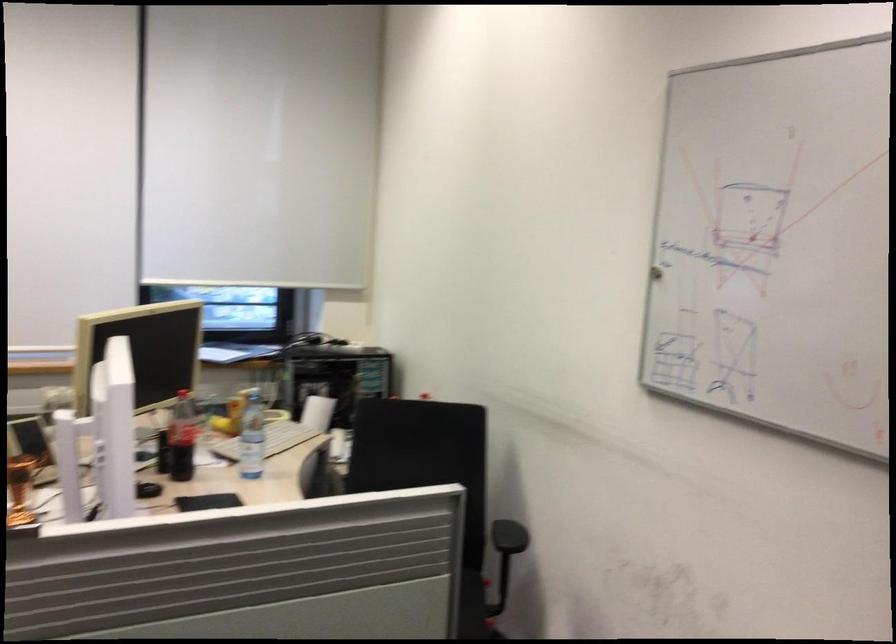
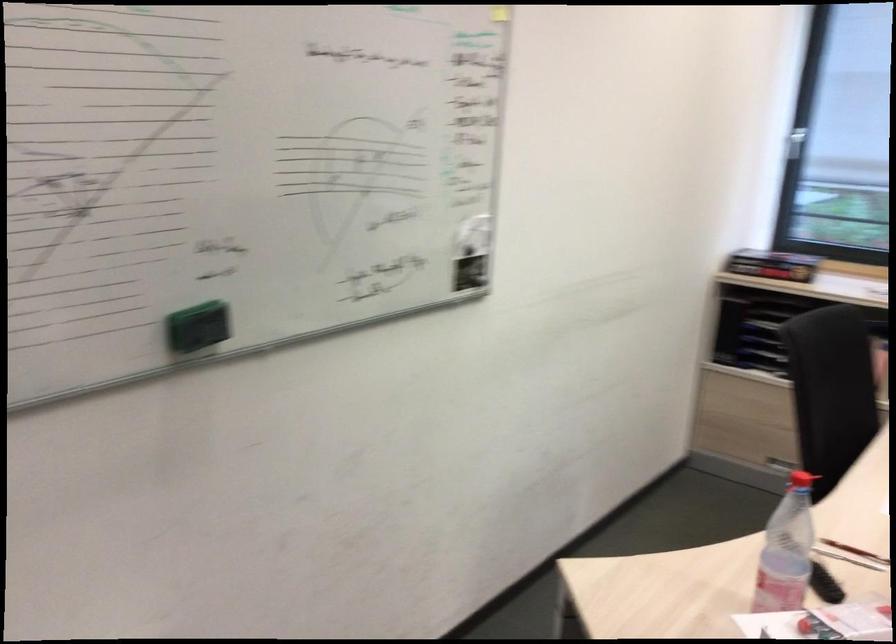
Question: How did the camera likely rotate?

Choices:
 (A) Left
 (B) Right
 (C) Up
 (D) Down

Answer: (A)